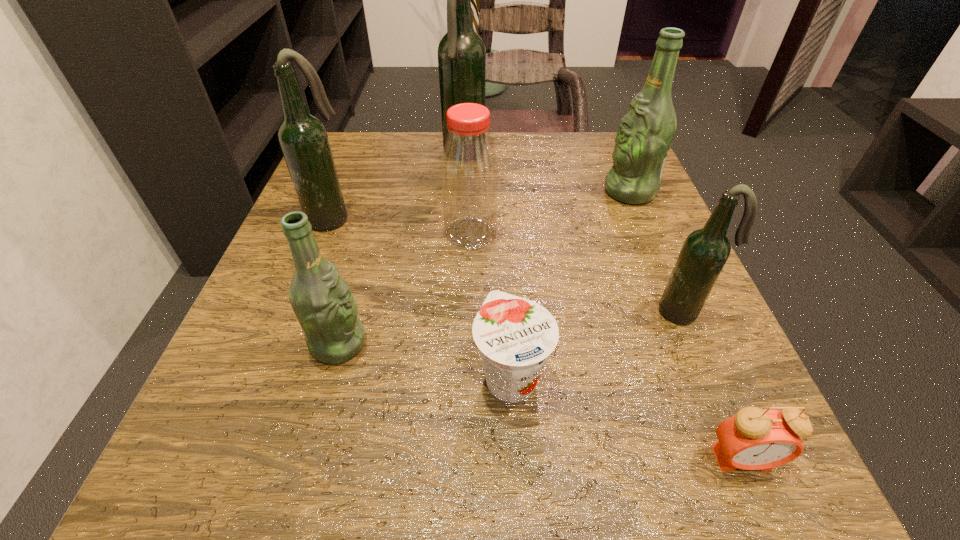
Image resolution: width=960 pixels, height=540 pixels. In the image, there is a desktop. Find the location of `vacant space at the right edge`. vacant space at the right edge is located at coordinates (711, 352).

In the image, there is a desktop. At what (x,y) coordinates should I click in order to perform the action: click on vacant space at the far left corner. Please return your answer as a coordinate pair (x, y). This screenshot has width=960, height=540. Looking at the image, I should click on (355, 163).

The height and width of the screenshot is (540, 960). Identify the location of blank area at the far right corner. (604, 135).

Where is `unoccupied position between the right green beer bottle and the red bottle`? The height and width of the screenshot is (540, 960). unoccupied position between the right green beer bottle and the red bottle is located at coordinates (550, 213).

Find the location of a particular element. The width and height of the screenshot is (960, 540). free spot between the rightmost dark beer bottle and the tallest object is located at coordinates (574, 233).

Identify the location of vacant space that is in between the third beer bottle from right to left and the yogurt. This screenshot has height=540, width=960. (488, 266).

What are the coordinates of `vacant space in between the leftmost beer bottle and the yogurt` in the screenshot? It's located at (420, 297).

Image resolution: width=960 pixels, height=540 pixels. I want to click on free space between the bigger green beer bottle and the yogurt, so (570, 284).

Where is `free point between the smaller green beer bottle and the nearest object`? This screenshot has width=960, height=540. free point between the smaller green beer bottle and the nearest object is located at coordinates (540, 401).

Where is `empty space that is in between the nearest object and the biggest dark beer bottle`? The width and height of the screenshot is (960, 540). empty space that is in between the nearest object and the biggest dark beer bottle is located at coordinates [x=603, y=307].